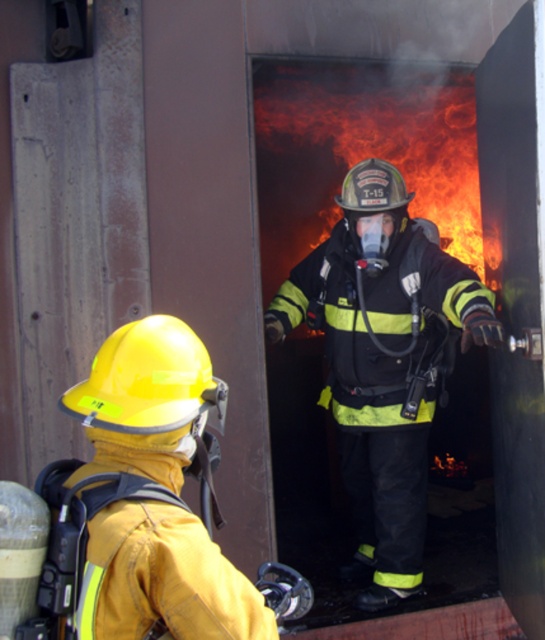
Question: Which of the following is the farthest from the observer?

Choices:
 (A) yellow matte helmet at left
 (B) black matte fireman at center

Answer: (B)

Question: Which object is farther from the camera taking this photo?

Choices:
 (A) black matte fireman at center
 (B) yellow matte helmet at left

Answer: (A)

Question: Is black matte fireman at center wider than yellow matte helmet at left?

Choices:
 (A) yes
 (B) no

Answer: (A)

Question: Does black matte fireman at center have a smaller size compared to yellow matte helmet at left?

Choices:
 (A) no
 (B) yes

Answer: (A)

Question: Where is black matte fireman at center located in relation to yellow matte helmet at left in the image?

Choices:
 (A) above
 (B) below

Answer: (A)

Question: Which object is farther from the camera taking this photo?

Choices:
 (A) yellow matte helmet at left
 (B) black matte fireman at center

Answer: (B)